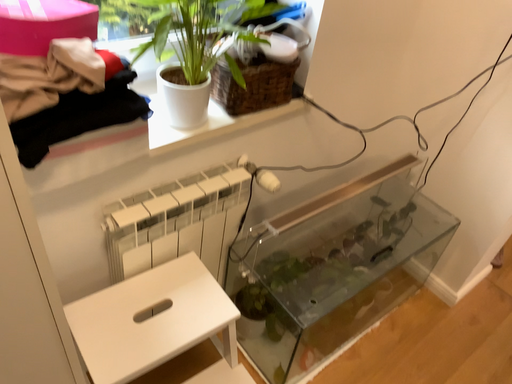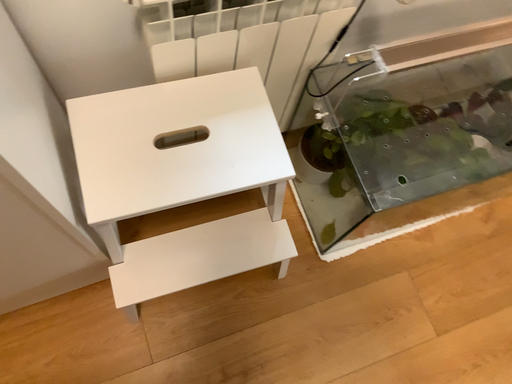
Question: Which way did the camera rotate in the video?

Choices:
 (A) rotated downward
 (B) rotated upward

Answer: (A)